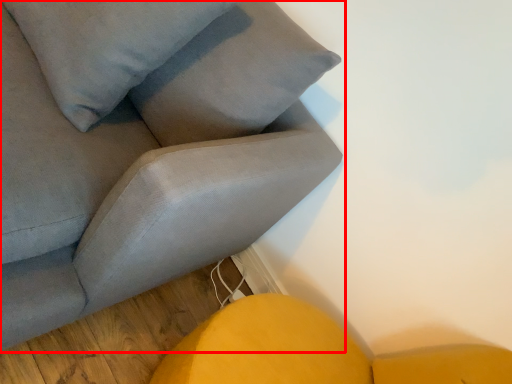
Question: Considering the relative positions of studio couch (annotated by the red box) and pillow in the image provided, where is studio couch (annotated by the red box) located with respect to the staircase?

Choices:
 (A) right
 (B) left

Answer: (B)